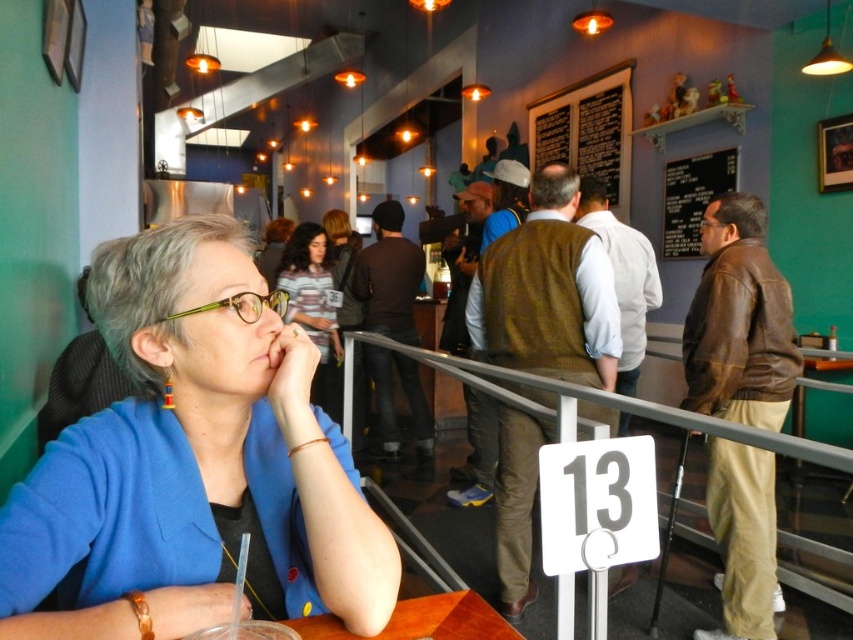
Question: Which point is farther to the camera?

Choices:
 (A) metallic gray rail at center
 (B) translucent plastic cup at lower center
 (C) blue fabric jacket at upper left
 (D) striped fabric shirt at center

Answer: (D)

Question: Is black chalkboard at upper center below yellow-green plastic glasses at center?

Choices:
 (A) yes
 (B) no

Answer: (B)

Question: Considering the relative positions of metallic gray rail at center and translucent plastic cup at lower center in the image provided, where is metallic gray rail at center located with respect to translucent plastic cup at lower center?

Choices:
 (A) above
 (B) below

Answer: (A)

Question: Is metallic gray rail at center smaller than yellow-green plastic glasses at center?

Choices:
 (A) no
 (B) yes

Answer: (A)

Question: Which object is farther from the camera taking this photo?

Choices:
 (A) translucent plastic cup at lower center
 (B) black chalkboard at upper right
 (C) yellow-green plastic glasses at center

Answer: (B)

Question: Among these objects, which one is farthest from the camera?

Choices:
 (A) metallic gray rail at center
 (B) black chalkboard at upper center
 (C) black chalkboard at upper right

Answer: (B)